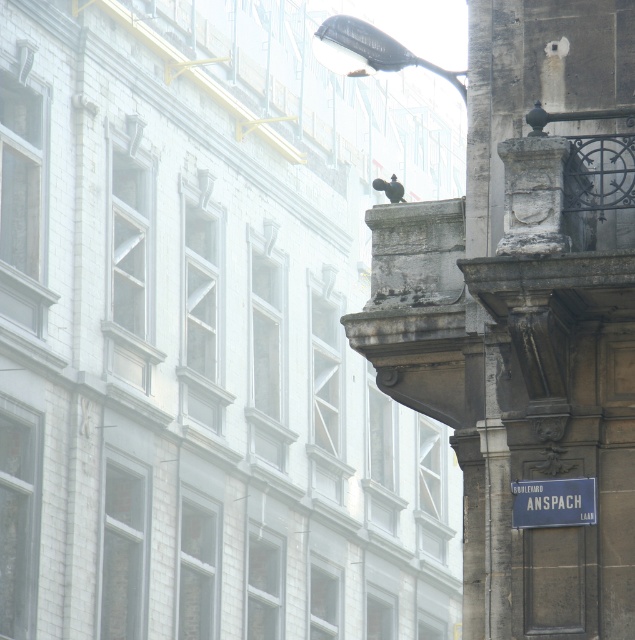
Between black glass streetlight at upper center and blue metallic street sign at lower right, which one is positioned higher?

black glass streetlight at upper center is higher up.

Who is more distant from viewer, (x=326, y=26) or (x=556, y=520)?

Positioned behind is point (x=326, y=26).

The image size is (635, 640). Identify the location of black glass streetlight at upper center. tap(368, 51).